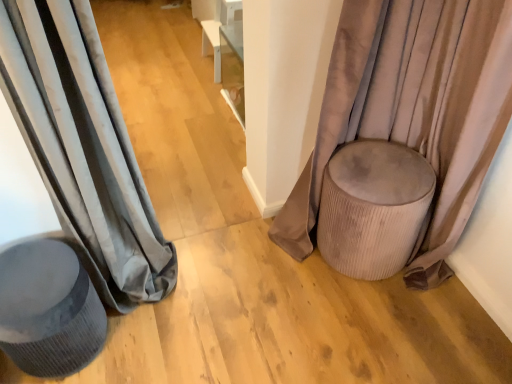
Question: Can you confirm if velvet beige pouf at right, the 2th curtain viewed from the left, is wider than suede beige ottoman at right?

Choices:
 (A) yes
 (B) no

Answer: (B)

Question: Is velvet beige pouf at right, the 1th curtain positioned from the right, positioned before suede beige ottoman at right?

Choices:
 (A) no
 (B) yes

Answer: (B)

Question: Considering the relative sizes of velvet beige pouf at right, the 2th curtain viewed from the left, and suede beige ottoman at right in the image provided, is velvet beige pouf at right, the 2th curtain viewed from the left, smaller than suede beige ottoman at right?

Choices:
 (A) yes
 (B) no

Answer: (B)

Question: Does velvet beige pouf at right, the 2th curtain viewed from the left, appear on the left side of suede beige ottoman at right?

Choices:
 (A) no
 (B) yes

Answer: (B)

Question: Can you confirm if velvet beige pouf at right, the 2th curtain viewed from the left, is thinner than suede beige ottoman at right?

Choices:
 (A) yes
 (B) no

Answer: (A)

Question: Considering the positions of suede beige ottoman at right and velvet beige pouf at right, the 2th curtain viewed from the left, in the image, is suede beige ottoman at right bigger or smaller than velvet beige pouf at right, the 2th curtain viewed from the left,?

Choices:
 (A) small
 (B) big

Answer: (A)

Question: In terms of height, does suede beige ottoman at right look taller or shorter compared to velvet beige pouf at right, the 1th curtain positioned from the right?

Choices:
 (A) short
 (B) tall

Answer: (A)

Question: From a real-world perspective, is suede beige ottoman at right above or below velvet beige pouf at right, the 2th curtain viewed from the left?

Choices:
 (A) below
 (B) above

Answer: (A)

Question: Relative to velvet beige pouf at right, the 2th curtain viewed from the left, is suede beige ottoman at right in front or behind?

Choices:
 (A) front
 (B) behind

Answer: (B)

Question: Considering their positions, is matte gray stool at left located in front of or behind matte gray curtain at left, the 1th curtain viewed from the left?

Choices:
 (A) behind
 (B) front

Answer: (A)

Question: From the image's perspective, is matte gray stool at left above or below matte gray curtain at left, the 1th curtain viewed from the left?

Choices:
 (A) above
 (B) below

Answer: (B)

Question: Is matte gray stool at left situated inside matte gray curtain at left, the 2th curtain positioned from the right, or outside?

Choices:
 (A) inside
 (B) outside

Answer: (B)

Question: Would you say matte gray stool at left is to the left or to the right of matte gray curtain at left, the 1th curtain viewed from the left, in the picture?

Choices:
 (A) left
 (B) right

Answer: (A)

Question: Would you say matte gray curtain at left, the 2th curtain positioned from the right, is inside or outside velvet beige pouf at right, the 1th curtain positioned from the right?

Choices:
 (A) outside
 (B) inside

Answer: (A)

Question: Is point pyautogui.click(x=50, y=178) closer or farther from the camera than point pyautogui.click(x=460, y=69)?

Choices:
 (A) closer
 (B) farther

Answer: (A)